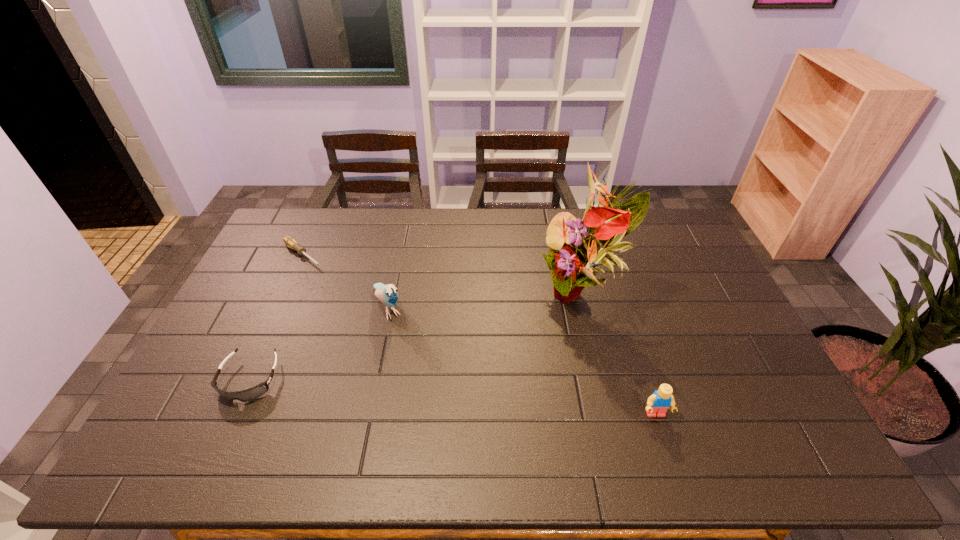
The height and width of the screenshot is (540, 960). Identify the location of goggles that is positioned at the left edge. (255, 392).

Locate an element on the screen. The height and width of the screenshot is (540, 960). screwdriver that is at the left edge is located at coordinates (290, 242).

The width and height of the screenshot is (960, 540). I want to click on object that is at the far left corner, so click(290, 242).

Locate an element on the screen. This screenshot has width=960, height=540. object located at the near left corner is located at coordinates (255, 392).

The height and width of the screenshot is (540, 960). In the image, there is a desktop. Find the location of `free space at the far edge`. free space at the far edge is located at coordinates (548, 221).

Identify the location of free region at the near edge. (346, 408).

The height and width of the screenshot is (540, 960). Find the location of `free space at the left edge of the desktop`. free space at the left edge of the desktop is located at coordinates (232, 306).

The image size is (960, 540). In the image, there is a desktop. In order to click on vacant area at the far right corner in this screenshot , I will do `click(657, 230)`.

Identify the location of vacant space at the near right corner of the desktop. (771, 406).

Find the location of a particular element. vacant space in between the second tallest object and the bouquet is located at coordinates (486, 300).